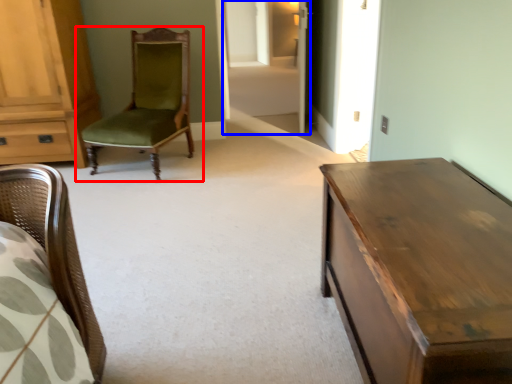
Question: Which object is further to the camera taking this photo, chair (highlighted by a red box) or glass door (highlighted by a blue box)?

Choices:
 (A) chair
 (B) glass door

Answer: (B)